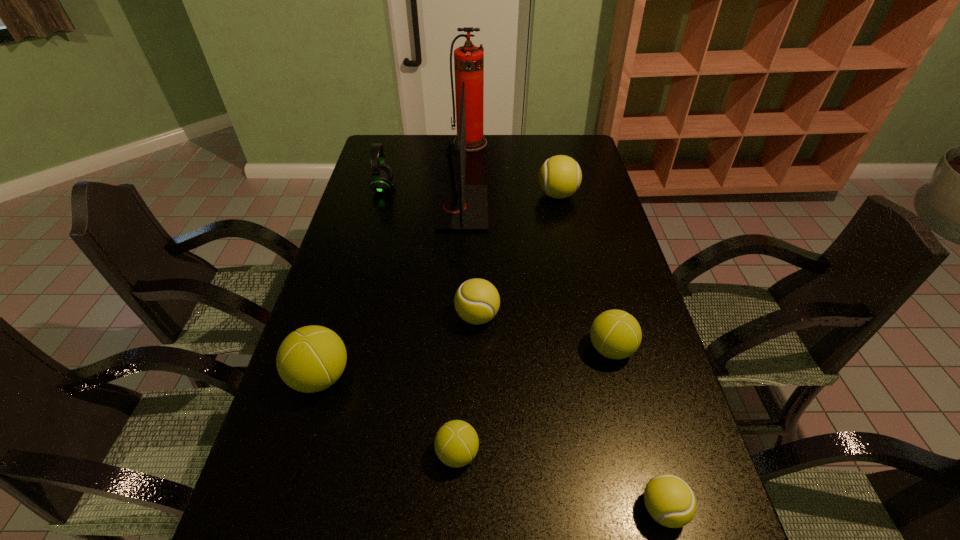
Locate an element on the screen. vacant region at the right edge of the desktop is located at coordinates (575, 198).

Identify the location of vacant area at the far right corner of the desktop. (570, 148).

Image resolution: width=960 pixels, height=540 pixels. I want to click on free spot between the rightmost green tennis ball and the nearest green tennis ball, so click(x=534, y=401).

Where is `vacant area between the leftmost yellow tennis ball and the leftmost green tennis ball`? The width and height of the screenshot is (960, 540). vacant area between the leftmost yellow tennis ball and the leftmost green tennis ball is located at coordinates click(398, 347).

The width and height of the screenshot is (960, 540). Find the location of `free space between the eighth farthest object and the headset`. free space between the eighth farthest object and the headset is located at coordinates (420, 320).

You are a GUI agent. You are given a task and a screenshot of the screen. Output one action in this format:
    pyautogui.click(x=<x>, y=<y>)
    Task: Click on the free space between the headset and the second biggest yellow tennis ball
    The width and height of the screenshot is (960, 540).
    Given the screenshot: What is the action you would take?
    pyautogui.click(x=430, y=252)

Locate an element on the screen. This screenshot has width=960, height=540. vacant area that lies between the second nearest yellow tennis ball and the black headset is located at coordinates (430, 252).

Locate an element on the screen. This screenshot has height=540, width=960. unoccupied position between the nearest tennis ball and the leftmost green tennis ball is located at coordinates 492,443.

Where is `vacant area that lies between the nearest object and the second farthest yellow tennis ball`? vacant area that lies between the nearest object and the second farthest yellow tennis ball is located at coordinates (570, 413).

Find the location of a particular element. The width and height of the screenshot is (960, 540). object that is the fourth closest to the nearest tennis ball is located at coordinates (312, 358).